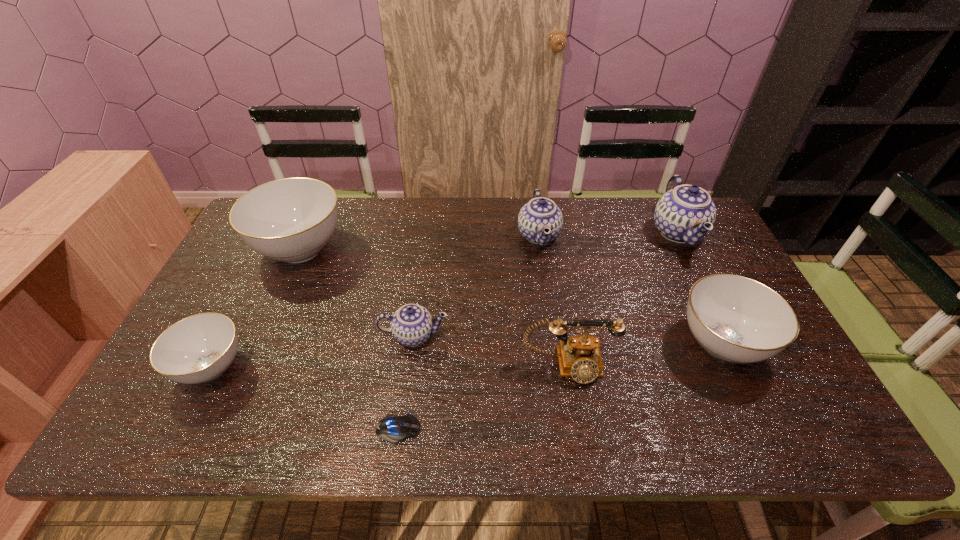
Where is `the rightmost blue chinaware`? This screenshot has width=960, height=540. the rightmost blue chinaware is located at coordinates (685, 214).

Locate an element on the screen. This screenshot has height=540, width=960. the farthest gray chinaware is located at coordinates (291, 220).

Where is `telephone`? Image resolution: width=960 pixels, height=540 pixels. telephone is located at coordinates 579,357.

Find the location of a particular element. the second biggest blue chinaware is located at coordinates pyautogui.click(x=540, y=214).

This screenshot has height=540, width=960. What are the coordinates of `the second blue chinaware from left to right` in the screenshot? It's located at (540, 214).

At what (x,y) coordinates should I click in order to perform the action: click on the second smallest gray chinaware. Please return your answer as a coordinate pair (x, y). This screenshot has width=960, height=540. Looking at the image, I should click on (734, 318).

You are a GUI agent. You are given a task and a screenshot of the screen. Output one action in this format:
    pyautogui.click(x=<x>, y=<y>)
    Task: Click on the third chinaware from left to right
    Image resolution: width=960 pixels, height=540 pixels.
    Given the screenshot: What is the action you would take?
    pyautogui.click(x=411, y=325)

You are a GUI agent. You are given a task and a screenshot of the screen. Output one action in this format:
    pyautogui.click(x=<x>, y=<y>)
    Task: Click on the nearest blue chinaware
    
    Given the screenshot: What is the action you would take?
    pyautogui.click(x=411, y=325)

You are a GUI agent. You are given a task and a screenshot of the screen. Output one action in this format:
    pyautogui.click(x=<x>, y=<y>)
    Task: Click on the smallest gray chinaware
    
    Given the screenshot: What is the action you would take?
    pyautogui.click(x=199, y=348)

At what (x,y) coordinates should I click in order to perform the action: click on the nearest object. Please return your answer as a coordinate pair (x, y). This screenshot has width=960, height=540. Looking at the image, I should click on (393, 428).